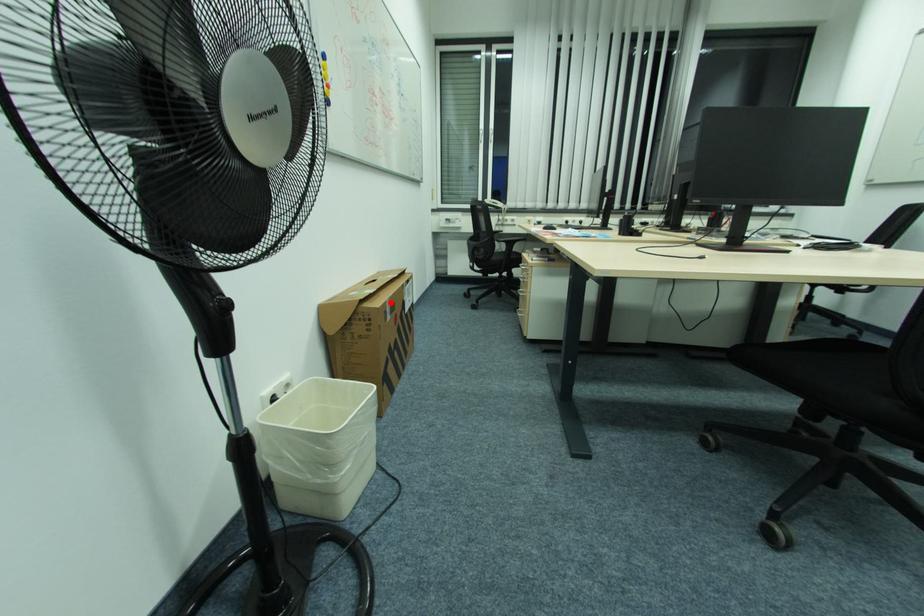
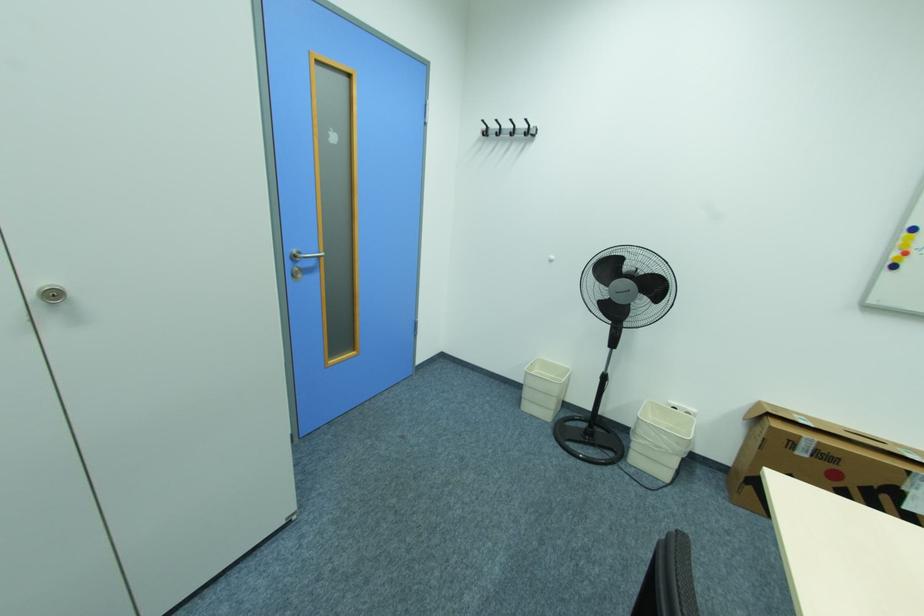
Question: A red point is marked in image1. In image2, is the corresponding 3D point closer to the camera or farther? Reply with the corresponding letter.

Choices:
 (A) The corresponding 3D point is closer.
 (B) The corresponding 3D point is farther.

Answer: (B)